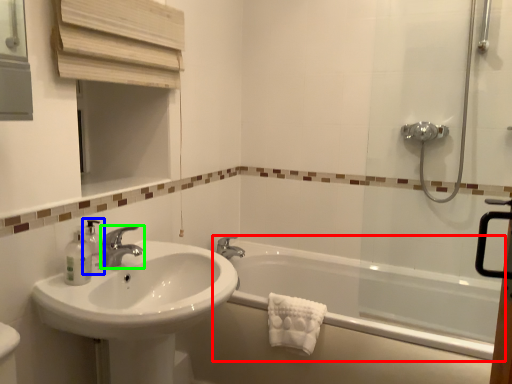
Question: Which object is positioned farthest from bathtub (highlighted by a red box)? Select from soap dispenser (highlighted by a blue box) and tap (highlighted by a green box).

Choices:
 (A) soap dispenser
 (B) tap

Answer: (A)